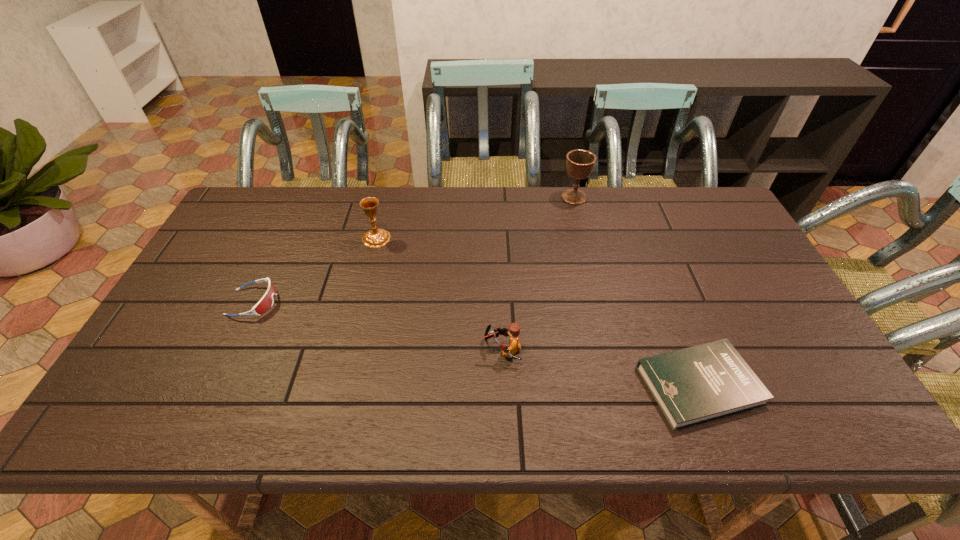
Image resolution: width=960 pixels, height=540 pixels. What are the coordinates of `the farthest object` in the screenshot? It's located at (580, 163).

The height and width of the screenshot is (540, 960). Find the location of `the farther chalice`. the farther chalice is located at coordinates (580, 163).

This screenshot has height=540, width=960. Find the location of `the nearer chalice`. the nearer chalice is located at coordinates (379, 237).

Locate an element on the screen. This screenshot has height=540, width=960. the fourth object from right to left is located at coordinates (379, 237).

You are a GUI agent. You are given a task and a screenshot of the screen. Output one action in this format:
    pyautogui.click(x=<x>, y=<y>)
    Task: Click on the third object from left to right
    
    Given the screenshot: What is the action you would take?
    pyautogui.click(x=514, y=329)

The width and height of the screenshot is (960, 540). I want to click on Lego, so click(x=514, y=329).

I want to click on the fourth tallest object, so click(266, 302).

In order to click on the leftmost object in this screenshot , I will do `click(266, 302)`.

The image size is (960, 540). What are the coordinates of `book` in the screenshot? It's located at (700, 383).

Identify the location of vacant space located on the front of the farthest object. (589, 256).